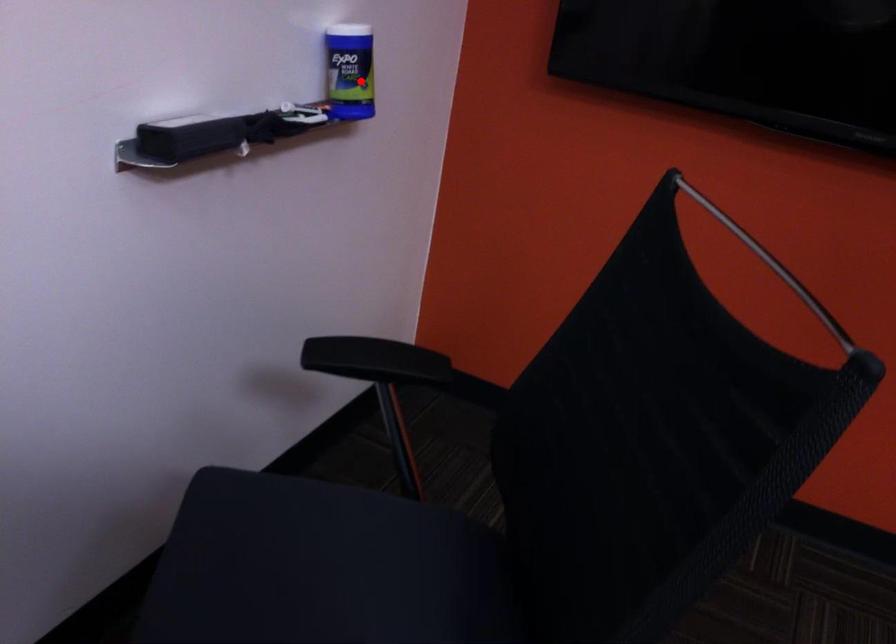
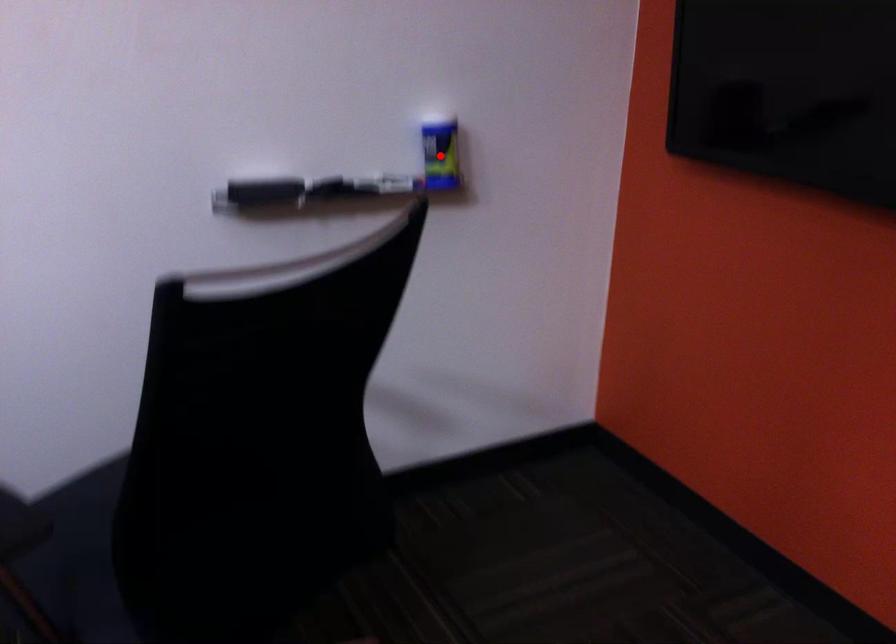
I am providing you with two images of the same scene from different viewpoints. A red point is marked on the first image and another point is marked on the second image. Is the red point in image1 aligned with the point shown in image2?

Yes